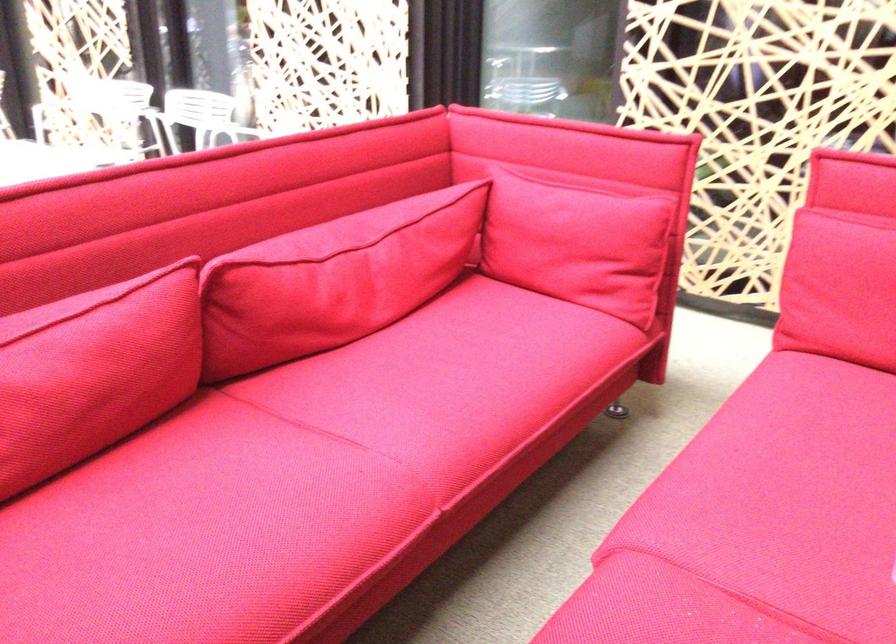
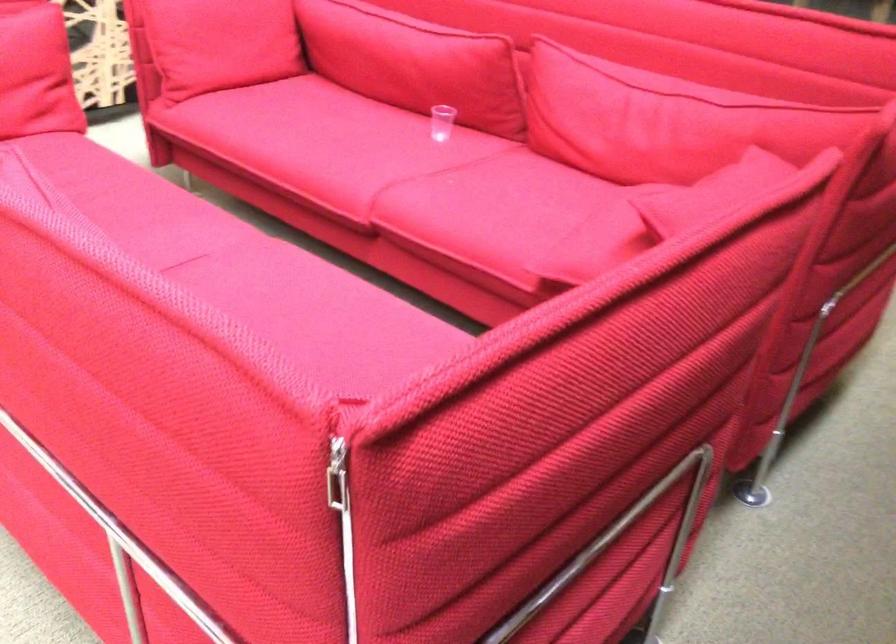
Question: I am providing you with two images of the same scene from different viewpoints. Please identify which objects are invisible in image2.

Choices:
 (A) red sofa armrest
 (B) silver zipper pull
 (C) red sofa cushion
 (D) none of these

Answer: (D)